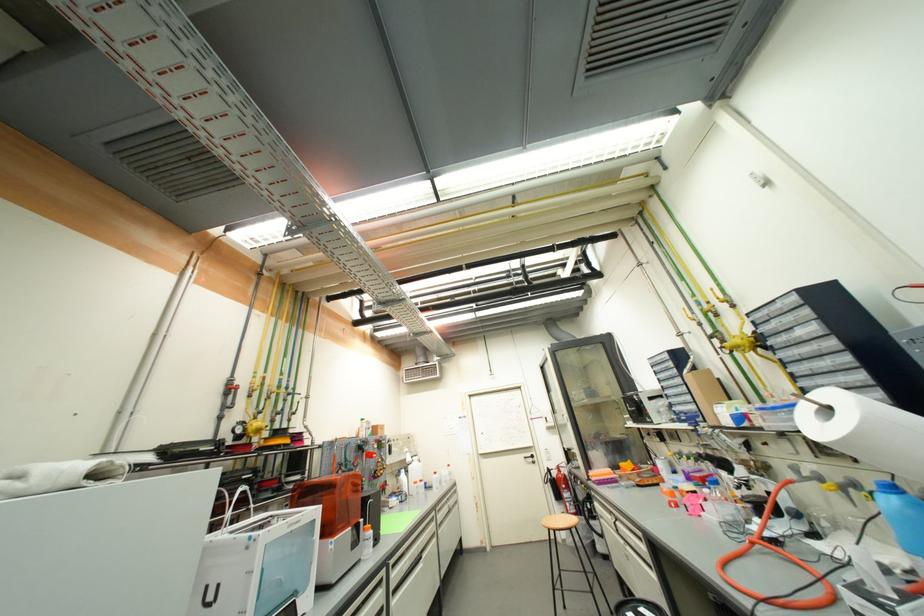
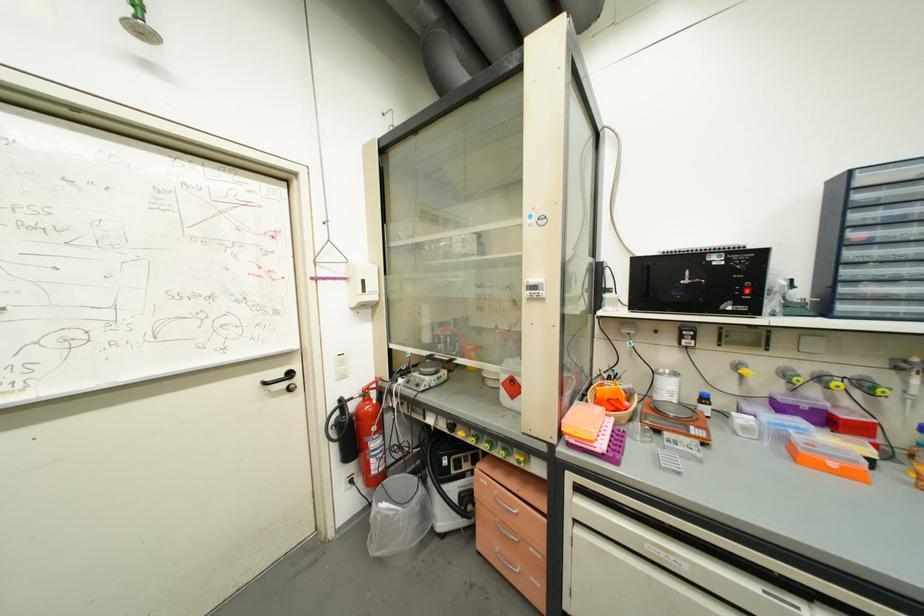
In the second image, find the point that corresponds to (x=560, y=476) in the first image.

(358, 408)